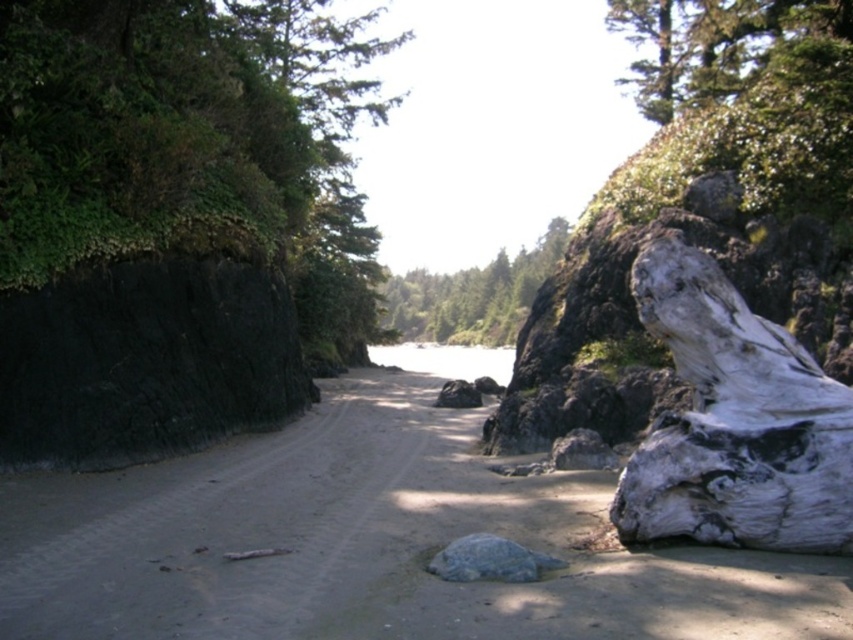
Question: Which of these objects is positioned farthest from the green leafy tree at center?

Choices:
 (A) gray rock at lower right
 (B) gray smooth rock at center
 (C) sandy/dry dirt track at center
 (D) green mossy rock at left

Answer: (C)

Question: Is green leafy tree at upper center bigger than green leafy tree at center?

Choices:
 (A) no
 (B) yes

Answer: (B)

Question: Which point is farther from the camera taking this photo?

Choices:
 (A) (3, 54)
 (B) (608, 461)
 (C) (637, 461)
 (D) (553, 499)

Answer: (B)

Question: Which of these objects is positioned closest to the gray rock at lower right?

Choices:
 (A) green leafy tree at center
 (B) green leafy tree at upper center

Answer: (B)

Question: Where is green leafy tree at upper center located in relation to green leafy tree at center in the image?

Choices:
 (A) below
 (B) above

Answer: (B)

Question: Does sandy/dry dirt track at center have a lesser width compared to green leafy tree at center?

Choices:
 (A) no
 (B) yes

Answer: (B)